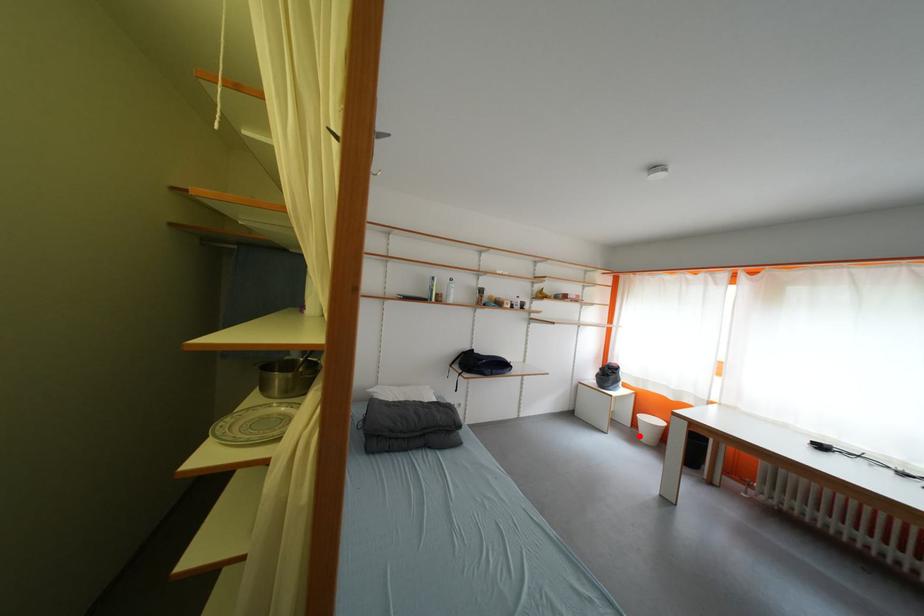
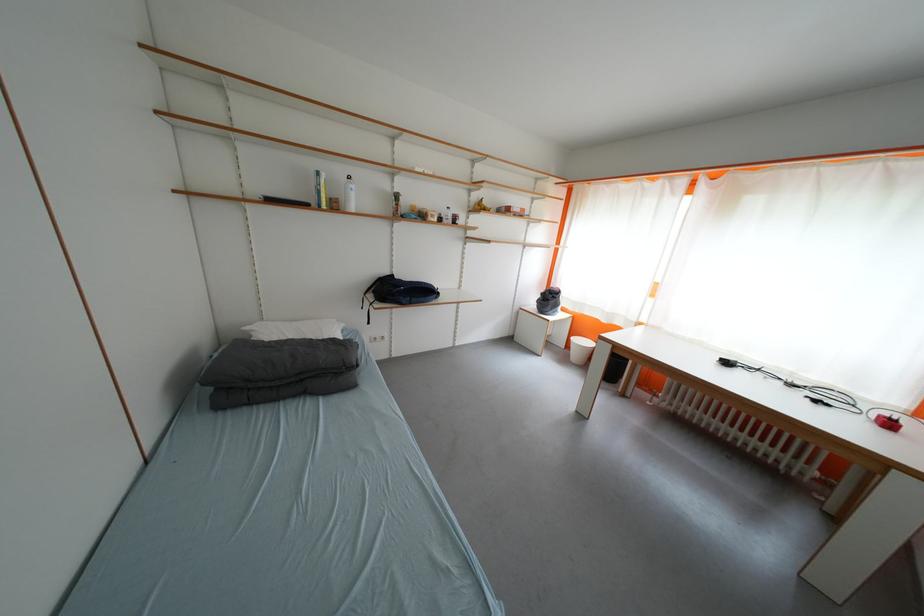
Question: I am providing you with two images of the same scene from different viewpoints. A red point is shown in image1. For the corresponding object point in image2, is it positioned nearer or farther from the camera?

Choices:
 (A) Nearer
 (B) Farther

Answer: (A)